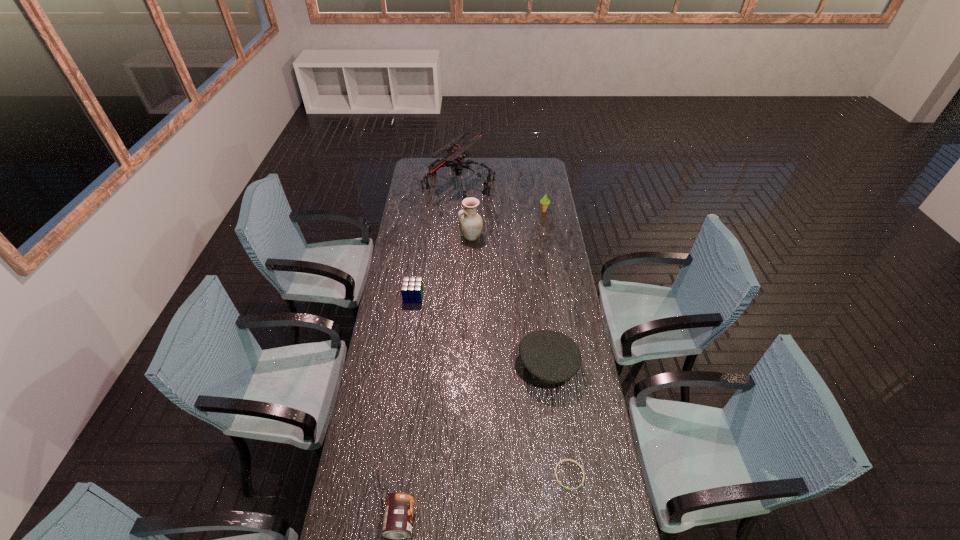
Image resolution: width=960 pixels, height=540 pixels. Identify the location of free space between the cube and the pottery. (443, 267).

You are a GUI agent. You are given a task and a screenshot of the screen. Output one action in this format:
    pyautogui.click(x=<x>, y=<y>)
    Task: Click on the unoccupied area between the beret and the icecream
    
    Given the screenshot: What is the action you would take?
    pyautogui.click(x=545, y=288)

Where is `unoccupied area between the fifth nearest object and the nearest object`? This screenshot has height=540, width=960. unoccupied area between the fifth nearest object and the nearest object is located at coordinates (436, 379).

Identify the location of vacant area between the sixth nearest object and the fifth farthest object. (545, 288).

Identify the location of vacant space that's between the beret and the second farthest object. The height and width of the screenshot is (540, 960). (545, 288).

This screenshot has height=540, width=960. Identify the location of vacant point located between the pottery and the nearest object. (436, 379).

This screenshot has height=540, width=960. Identify the location of unoccupied position between the second farthest object and the cube. (479, 254).

Image resolution: width=960 pixels, height=540 pixels. Find the location of `vacant region between the third nearest object and the cube`. vacant region between the third nearest object and the cube is located at coordinates (480, 331).

Find the location of a particular element. This screenshot has height=540, width=960. free spot between the fifth farthest object and the fourth farthest object is located at coordinates (480, 331).

Where is `empty space between the pottery and the fifth farthest object`? empty space between the pottery and the fifth farthest object is located at coordinates (509, 301).